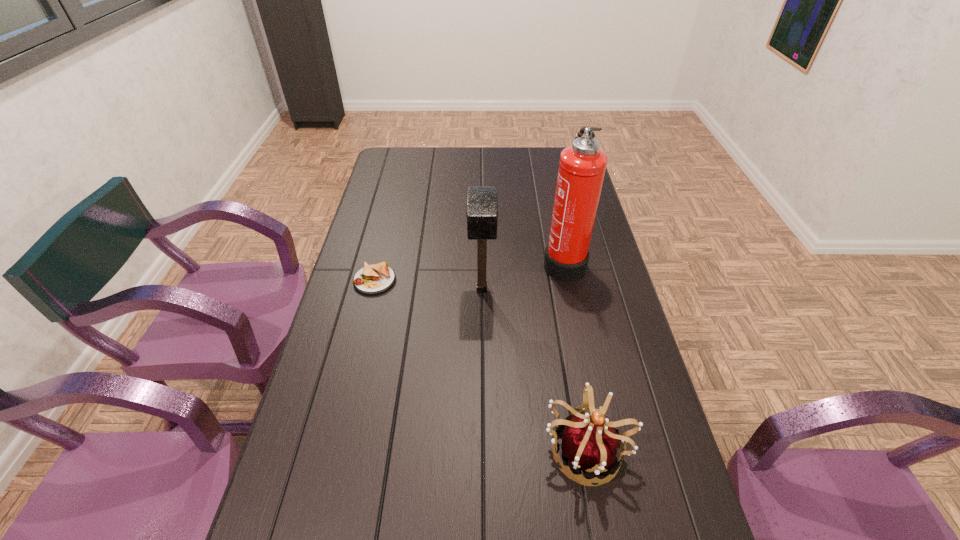
I want to click on vacant space located 0.290m on the front of the second object from left to right, so click(482, 390).

Where is `vacant space located on the front-facing side of the nearest object`? Image resolution: width=960 pixels, height=540 pixels. vacant space located on the front-facing side of the nearest object is located at coordinates (597, 516).

Where is `vacant space located 0.330m on the back of the leftmost object`? vacant space located 0.330m on the back of the leftmost object is located at coordinates (393, 208).

This screenshot has width=960, height=540. What are the coordinates of `object present at the left edge` in the screenshot? It's located at (373, 279).

Locate an element on the screen. This screenshot has height=540, width=960. fire extinguisher located at the right edge is located at coordinates (582, 166).

Where is `tiara located in the right edge section of the desktop`? tiara located in the right edge section of the desktop is located at coordinates (590, 442).

The height and width of the screenshot is (540, 960). Identify the location of vacant space at the far edge of the desktop. (456, 157).

In the image, there is a desktop. Where is `vacant space at the left edge`? vacant space at the left edge is located at coordinates coord(366,209).

The width and height of the screenshot is (960, 540). In the image, there is a desktop. Identify the location of free space at the right edge. (625, 418).

Where is `empty space between the second tallest object and the fire extinguisher`? empty space between the second tallest object and the fire extinguisher is located at coordinates (522, 275).